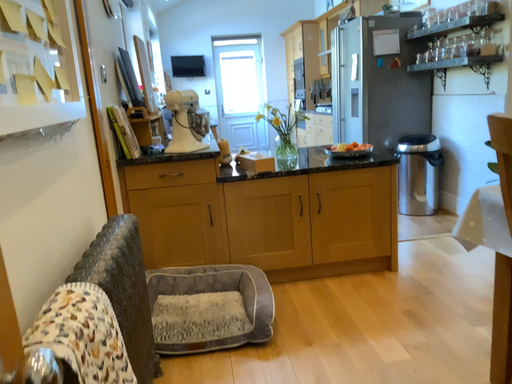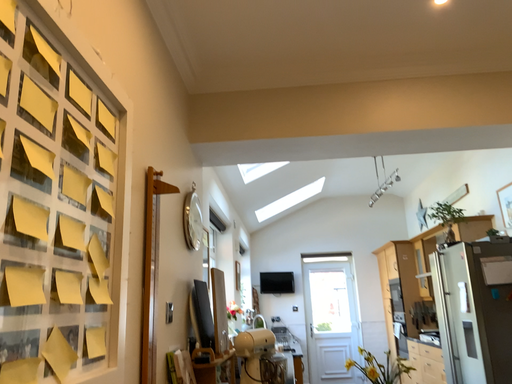
Question: How did the camera likely rotate when shooting the video?

Choices:
 (A) rotated left
 (B) rotated right

Answer: (A)